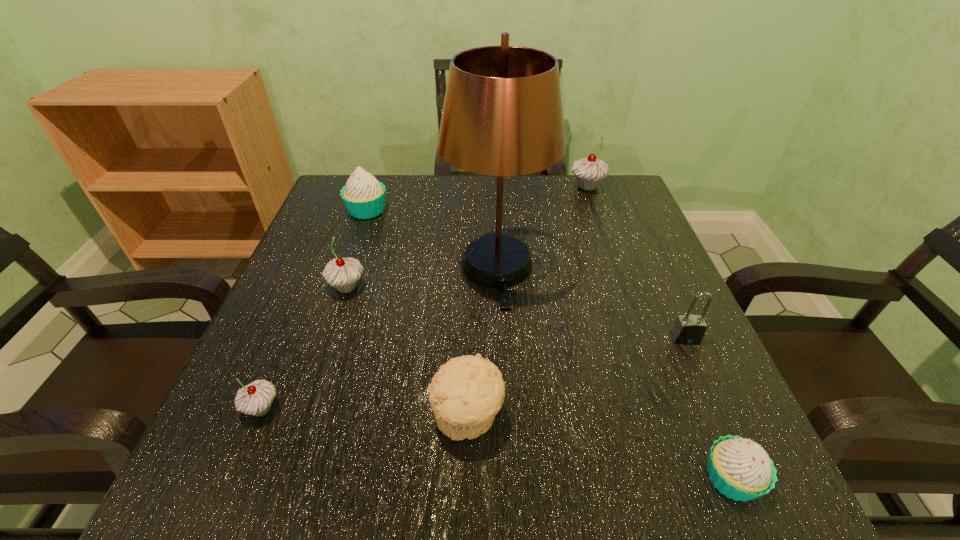
You are a GUI agent. You are given a task and a screenshot of the screen. Output one action in this format:
    pyautogui.click(x=<x>, y=<y>)
    Task: Click on the free space between the second gray cupcake from left to right and the fourth farthest cupcake
    The image size is (960, 540).
    Given the screenshot: What is the action you would take?
    pyautogui.click(x=304, y=348)

Image resolution: width=960 pixels, height=540 pixels. Find the location of `vacant point located between the farthest cupcake and the gray padlock`. vacant point located between the farthest cupcake and the gray padlock is located at coordinates (636, 262).

Where is `free space between the second biggest gray cupcake and the padlock`? Image resolution: width=960 pixels, height=540 pixels. free space between the second biggest gray cupcake and the padlock is located at coordinates (516, 312).

Point out which object is positioned as the third nearest to the nearest cupcake. Please provide its 2D coordinates. Your answer should be formatted as a tuple, i.e. [(x, y)], where the tuple contains the x and y coordinates of a point satisfying the conditions above.

[(502, 116)]

Locate which object is the second closest to the fourth nearest object. Please provide its 2D coordinates. Your answer should be formatted as a tuple, i.e. [(x, y)], where the tuple contains the x and y coordinates of a point satisfying the conditions above.

[(502, 116)]

Locate an element on the screen. cupcake that stands as the closest to the second biggest gray cupcake is located at coordinates (364, 197).

Where is `cupcake that stands as the second closest to the third farthest cupcake`? Image resolution: width=960 pixels, height=540 pixels. cupcake that stands as the second closest to the third farthest cupcake is located at coordinates (256, 398).

Identify which gray cupcake is the closest to the seventh nearest object. Please provide its 2D coordinates. Your answer should be formatted as a tuple, i.e. [(x, y)], where the tuple contains the x and y coordinates of a point satisfying the conditions above.

[(343, 274)]

Locate an element on the screen. Image resolution: width=960 pixels, height=540 pixels. gray cupcake that is the nearest to the muffin is located at coordinates (256, 398).

This screenshot has width=960, height=540. I want to click on vacant space that satisfies the following two spatial constraints: 1. on the front side of the beige muffin; 2. on the left side of the nearest gray cupcake, so click(x=258, y=417).